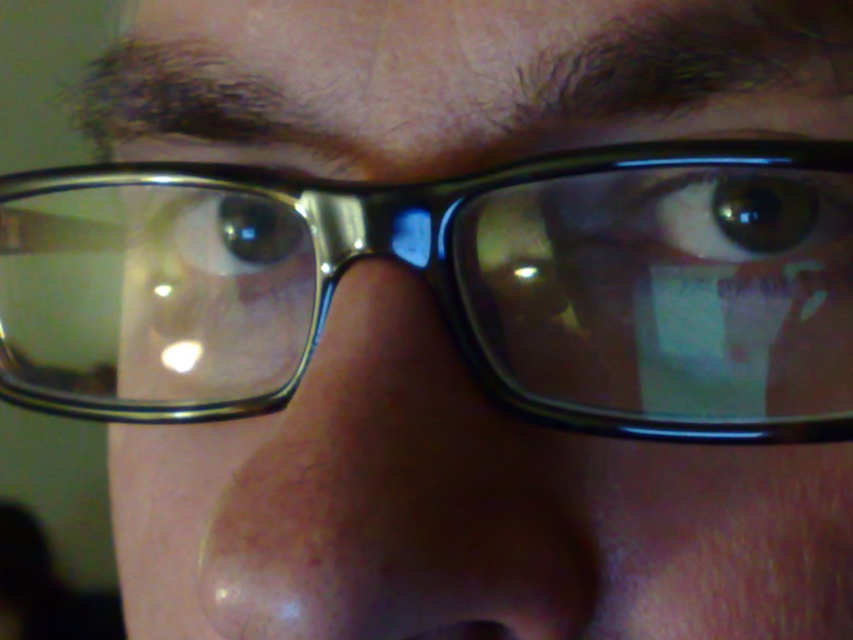
You are a photographer adjusting lighting for a portrait. You notice the clear plastic glasses at center and the green matte eye at center. Which object will cast a larger reflection in the photo?

The clear plastic glasses at center is bigger than the green matte eye at center, so it will cast a larger reflection in the photo.

You are a dermatologist examining a patient. You notice the clear skin nose at center and the brown glossy eye at center. Which object is positioned to the left?

The brown glossy eye at center is positioned to the left of the clear skin nose at center.